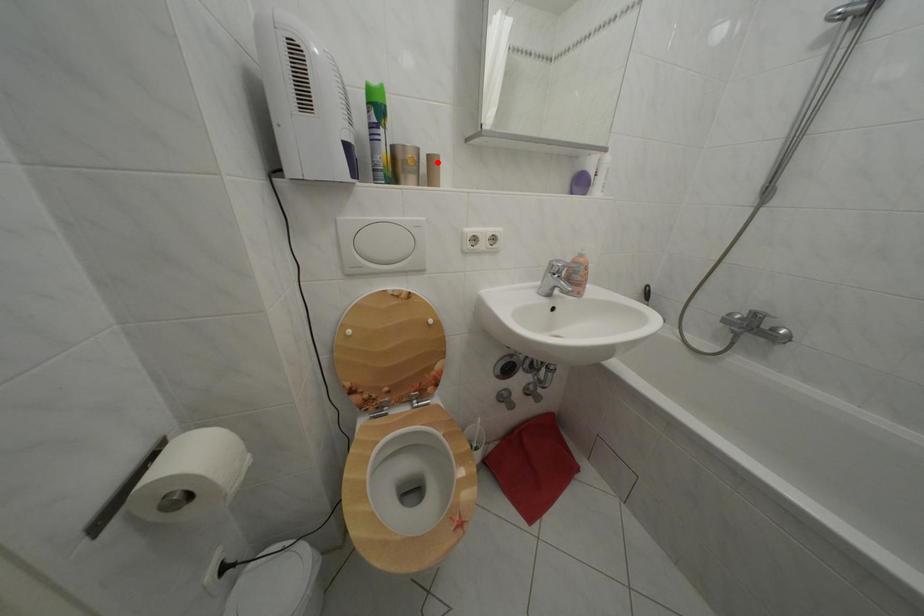
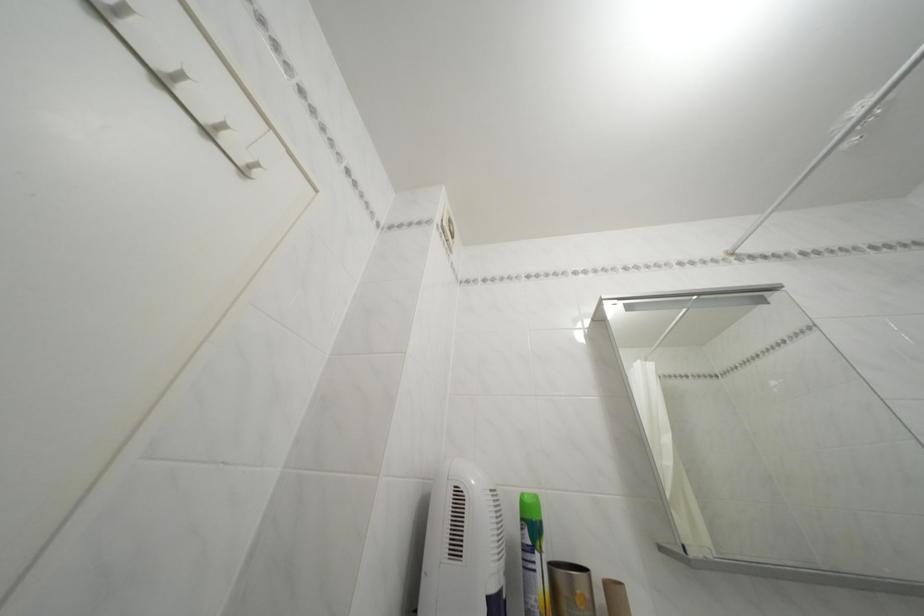
Where in the second image is the point corresponding to the highlighted location from the first image?

(614, 591)